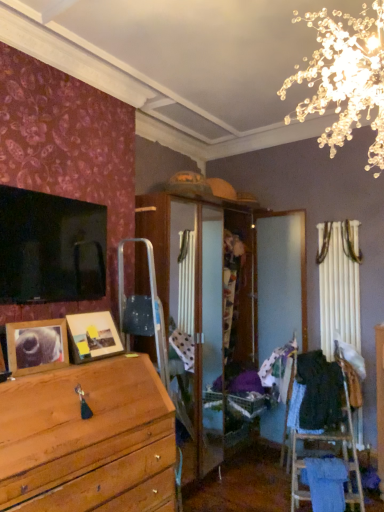
What do you see at coordinates (319, 392) in the screenshot? The image size is (384, 512). I see `black fabric at right, the first clothing when ordered from right to left` at bounding box center [319, 392].

How much space does wooden photo frame at center, which is the first picture frame in back-to-front order, occupy horizontally?

It is 8.19 inches.

The image size is (384, 512). I want to click on wooden photo frame at center, which is the first picture frame in back-to-front order, so click(92, 336).

What is the approximate width of wooden picture frame at lower left, arranged as the second picture frame when viewed from the back?

3.38 inches.

I want to click on black fabric at right, the first clothing when ordered from right to left, so click(319, 392).

Would you say patterned fabric at center, positioned as the first clothing in left-to-right order, is inside or outside wooden picture frame at lower left, the 1th picture frame viewed from the front?

patterned fabric at center, positioned as the first clothing in left-to-right order, is not enclosed by wooden picture frame at lower left, the 1th picture frame viewed from the front.

From a real-world perspective, is patterned fabric at center, positioned as the first clothing in left-to-right order, physically located above or below wooden picture frame at lower left, the 1th picture frame viewed from the front?

From a real-world perspective, patterned fabric at center, positioned as the first clothing in left-to-right order, is physically below wooden picture frame at lower left, the 1th picture frame viewed from the front.

How many degrees apart are the facing directions of patterned fabric at center, which is the 2th clothing in right-to-left order, and wooden picture frame at lower left, arranged as the second picture frame when viewed from the back?

There is a 0.138-degree angle between the facing directions of patterned fabric at center, which is the 2th clothing in right-to-left order, and wooden picture frame at lower left, arranged as the second picture frame when viewed from the back.

Is patterned fabric at center, which is the 2th clothing in right-to-left order, positioned with its back to wooden picture frame at lower left, the 1th picture frame viewed from the front?

No, patterned fabric at center, which is the 2th clothing in right-to-left order,'s orientation is not away from wooden picture frame at lower left, the 1th picture frame viewed from the front.

Looking at their sizes, would you say black fabric at right, the first clothing when ordered from right to left, is wider or thinner than patterned fabric at center, positioned as the first clothing in left-to-right order?

black fabric at right, the first clothing when ordered from right to left, is wider than patterned fabric at center, positioned as the first clothing in left-to-right order.

Does black fabric at right, the first clothing when ordered from right to left, touch patterned fabric at center, positioned as the first clothing in left-to-right order?

black fabric at right, the first clothing when ordered from right to left, and patterned fabric at center, positioned as the first clothing in left-to-right order, are clearly separated.

Which object is positioned more to the left, black fabric at right, which appears as the second clothing when viewed from the left, or patterned fabric at center, positioned as the first clothing in left-to-right order?

patterned fabric at center, positioned as the first clothing in left-to-right order.

Is point (310, 391) more distant than point (289, 349)?

No.

From the image's perspective, which object appears higher, black fabric at right, which appears as the second clothing when viewed from the left, or wooden picture frame at lower left, the 1th picture frame viewed from the front?

wooden picture frame at lower left, the 1th picture frame viewed from the front, appears higher in the image.

Which object is thinner, black fabric at right, the first clothing when ordered from right to left, or wooden picture frame at lower left, the 1th picture frame viewed from the front?

With smaller width is wooden picture frame at lower left, the 1th picture frame viewed from the front.

Which object is closer to the camera, black fabric at right, the first clothing when ordered from right to left, or wooden picture frame at lower left, the 1th picture frame viewed from the front?

wooden picture frame at lower left, the 1th picture frame viewed from the front, is in front.

Which of these two, patterned fabric at center, which is the 2th clothing in right-to-left order, or wooden photo frame at center, which is the first picture frame in back-to-front order, is wider?

With larger width is patterned fabric at center, which is the 2th clothing in right-to-left order.

Based on the photo, is patterned fabric at center, which is the 2th clothing in right-to-left order, oriented away from wooden photo frame at center, which is the first picture frame in back-to-front order?

No.

Does patterned fabric at center, positioned as the first clothing in left-to-right order, have a greater height compared to wooden photo frame at center, acting as the 2th picture frame starting from the front?

Incorrect, the height of patterned fabric at center, positioned as the first clothing in left-to-right order, is not larger of that of wooden photo frame at center, acting as the 2th picture frame starting from the front.

Is wooden photo frame at center, acting as the 2th picture frame starting from the front, a part of patterned fabric at center, positioned as the first clothing in left-to-right order?

No, wooden photo frame at center, acting as the 2th picture frame starting from the front, is not surrounded by patterned fabric at center, positioned as the first clothing in left-to-right order.

Is patterned fabric at center, positioned as the first clothing in left-to-right order, located within wooden picture frame at lower left, arranged as the second picture frame when viewed from the back?

No, patterned fabric at center, positioned as the first clothing in left-to-right order, is not a part of wooden picture frame at lower left, arranged as the second picture frame when viewed from the back.

From the picture: Between wooden picture frame at lower left, arranged as the second picture frame when viewed from the back, and patterned fabric at center, positioned as the first clothing in left-to-right order, which one appears on the left side from the viewer's perspective?

wooden picture frame at lower left, arranged as the second picture frame when viewed from the back, is more to the left.

Can you tell me how much wooden picture frame at lower left, arranged as the second picture frame when viewed from the back, and patterned fabric at center, which is the 2th clothing in right-to-left order, differ in facing direction?

They differ by 0.138 degrees in their facing directions.

From the image's perspective, which is below, wooden picture frame at lower left, arranged as the second picture frame when viewed from the back, or patterned fabric at center, which is the 2th clothing in right-to-left order?

patterned fabric at center, which is the 2th clothing in right-to-left order.

Is wooden picture frame at lower left, the 1th picture frame viewed from the front, behind wooden photo frame at center, which is the first picture frame in back-to-front order?

No, it is not.

Between wooden picture frame at lower left, the 1th picture frame viewed from the front, and wooden photo frame at center, acting as the 2th picture frame starting from the front, which one appears on the left side from the viewer's perspective?

wooden picture frame at lower left, the 1th picture frame viewed from the front, is more to the left.

What's the angular difference between wooden picture frame at lower left, arranged as the second picture frame when viewed from the back, and wooden photo frame at center, which is the first picture frame in back-to-front order,'s facing directions?

The facing directions of wooden picture frame at lower left, arranged as the second picture frame when viewed from the back, and wooden photo frame at center, which is the first picture frame in back-to-front order, are 4.89 degrees apart.

Based on their sizes in the image, would you say wooden picture frame at lower left, the 1th picture frame viewed from the front, is bigger or smaller than wooden photo frame at center, acting as the 2th picture frame starting from the front?

wooden picture frame at lower left, the 1th picture frame viewed from the front, is smaller than wooden photo frame at center, acting as the 2th picture frame starting from the front.

Is wooden picture frame at lower left, the 1th picture frame viewed from the front, looking in the opposite direction of black fabric at right, which appears as the second clothing when viewed from the left?

No, wooden picture frame at lower left, the 1th picture frame viewed from the front, is not facing the opposite direction of black fabric at right, which appears as the second clothing when viewed from the left.

Does wooden picture frame at lower left, arranged as the second picture frame when viewed from the back, have a larger size compared to black fabric at right, the first clothing when ordered from right to left?

No, wooden picture frame at lower left, arranged as the second picture frame when viewed from the back, is not bigger than black fabric at right, the first clothing when ordered from right to left.

Looking at this image, does wooden picture frame at lower left, arranged as the second picture frame when viewed from the back, have a greater height compared to black fabric at right, which appears as the second clothing when viewed from the left?

In fact, wooden picture frame at lower left, arranged as the second picture frame when viewed from the back, may be shorter than black fabric at right, which appears as the second clothing when viewed from the left.

Image resolution: width=384 pixels, height=512 pixels. There is a wooden picture frame at lower left, the 1th picture frame viewed from the front. Identify the location of the 1st clothing below it (from the image's perspective). (279, 368).

The image size is (384, 512). Find the location of `clothing on the right of patterned fabric at center, positioned as the first clothing in left-to-right order`. clothing on the right of patterned fabric at center, positioned as the first clothing in left-to-right order is located at coordinates (319, 392).

Estimate the real-world distances between objects in this image. Which object is closer to wooden picture frame at lower left, arranged as the second picture frame when viewed from the back, patterned fabric at center, which is the 2th clothing in right-to-left order, or black fabric at right, the first clothing when ordered from right to left?

patterned fabric at center, which is the 2th clothing in right-to-left order, lies closer to wooden picture frame at lower left, arranged as the second picture frame when viewed from the back, than the other object.

Considering their positions, is patterned fabric at center, which is the 2th clothing in right-to-left order, positioned closer to wooden photo frame at center, which is the first picture frame in back-to-front order, than wooden picture frame at lower left, the 1th picture frame viewed from the front?

Among the two, wooden picture frame at lower left, the 1th picture frame viewed from the front, is located nearer to wooden photo frame at center, which is the first picture frame in back-to-front order.

Estimate the real-world distances between objects in this image. Which object is closer to patterned fabric at center, positioned as the first clothing in left-to-right order, black fabric at right, which appears as the second clothing when viewed from the left, or wooden picture frame at lower left, arranged as the second picture frame when viewed from the back?

black fabric at right, which appears as the second clothing when viewed from the left, lies closer to patterned fabric at center, positioned as the first clothing in left-to-right order, than the other object.

Which object lies further to the anchor point wooden photo frame at center, acting as the 2th picture frame starting from the front, patterned fabric at center, positioned as the first clothing in left-to-right order, or black fabric at right, which appears as the second clothing when viewed from the left?

black fabric at right, which appears as the second clothing when viewed from the left, is further to wooden photo frame at center, acting as the 2th picture frame starting from the front.

Looking at the image, which one is located closer to patterned fabric at center, positioned as the first clothing in left-to-right order, wooden photo frame at center, which is the first picture frame in back-to-front order, or wooden picture frame at lower left, arranged as the second picture frame when viewed from the back?

wooden photo frame at center, which is the first picture frame in back-to-front order, is positioned closer to the anchor patterned fabric at center, positioned as the first clothing in left-to-right order.

Considering their positions, is black fabric at right, the first clothing when ordered from right to left, positioned further to wooden picture frame at lower left, arranged as the second picture frame when viewed from the back, than patterned fabric at center, positioned as the first clothing in left-to-right order?

Among the two, black fabric at right, the first clothing when ordered from right to left, is located further to wooden picture frame at lower left, arranged as the second picture frame when viewed from the back.

Considering their positions, is black fabric at right, the first clothing when ordered from right to left, positioned further to patterned fabric at center, positioned as the first clothing in left-to-right order, than wooden photo frame at center, which is the first picture frame in back-to-front order?

The object further to patterned fabric at center, positioned as the first clothing in left-to-right order, is wooden photo frame at center, which is the first picture frame in back-to-front order.

Based on their spatial positions, is wooden photo frame at center, acting as the 2th picture frame starting from the front, or patterned fabric at center, positioned as the first clothing in left-to-right order, further from wooden picture frame at lower left, the 1th picture frame viewed from the front?

patterned fabric at center, positioned as the first clothing in left-to-right order, is further to wooden picture frame at lower left, the 1th picture frame viewed from the front.

The height and width of the screenshot is (512, 384). I want to click on clothing situated between wooden picture frame at lower left, arranged as the second picture frame when viewed from the back, and black fabric at right, the first clothing when ordered from right to left, from left to right, so click(x=279, y=368).

At what (x,y) coordinates should I click in order to perform the action: click on picture frame located between wooden picture frame at lower left, the 1th picture frame viewed from the front, and patterned fabric at center, which is the 2th clothing in right-to-left order, in the left-right direction. Please return your answer as a coordinate pair (x, y). Image resolution: width=384 pixels, height=512 pixels. Looking at the image, I should click on (92, 336).

This screenshot has width=384, height=512. In order to click on clothing situated between wooden photo frame at center, acting as the 2th picture frame starting from the front, and black fabric at right, the first clothing when ordered from right to left, from left to right in this screenshot , I will do `click(279, 368)`.

What are the coordinates of `picture frame between wooden picture frame at lower left, the 1th picture frame viewed from the front, and black fabric at right, the first clothing when ordered from right to left, in the horizontal direction` in the screenshot? It's located at (92, 336).